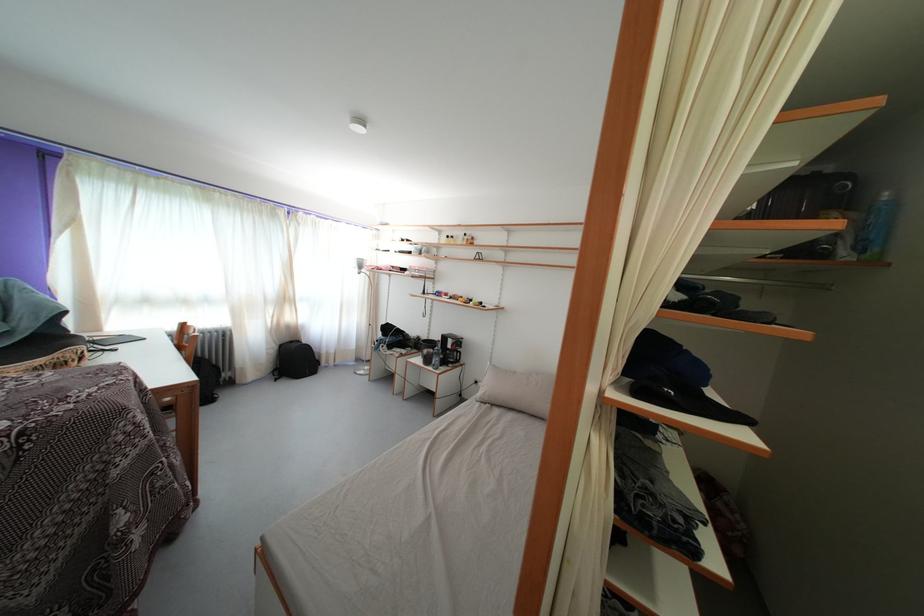
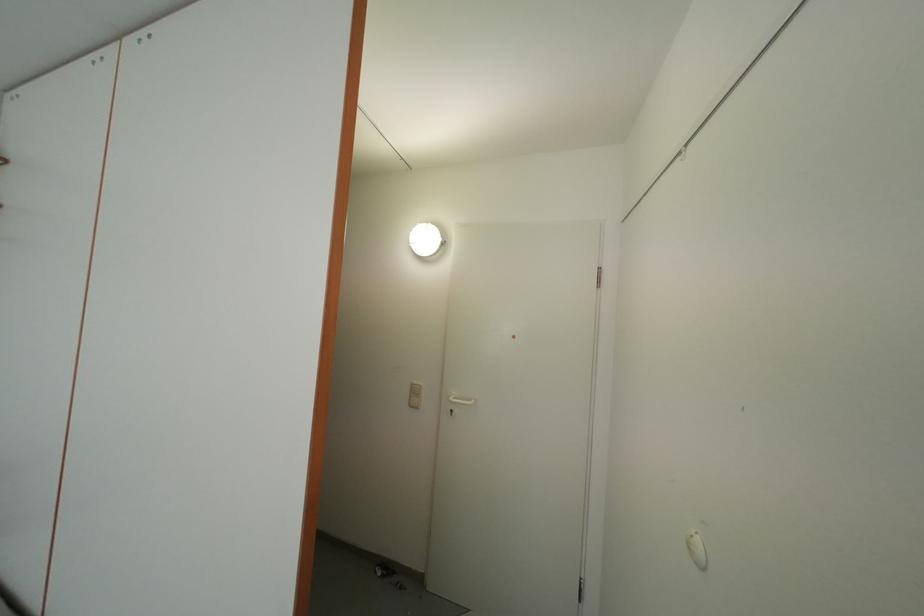
Question: The images are taken continuously from a first-person perspective. In which direction is your viewpoint rotating?

Choices:
 (A) Left
 (B) Right
 (C) Up
 (D) Down

Answer: (B)